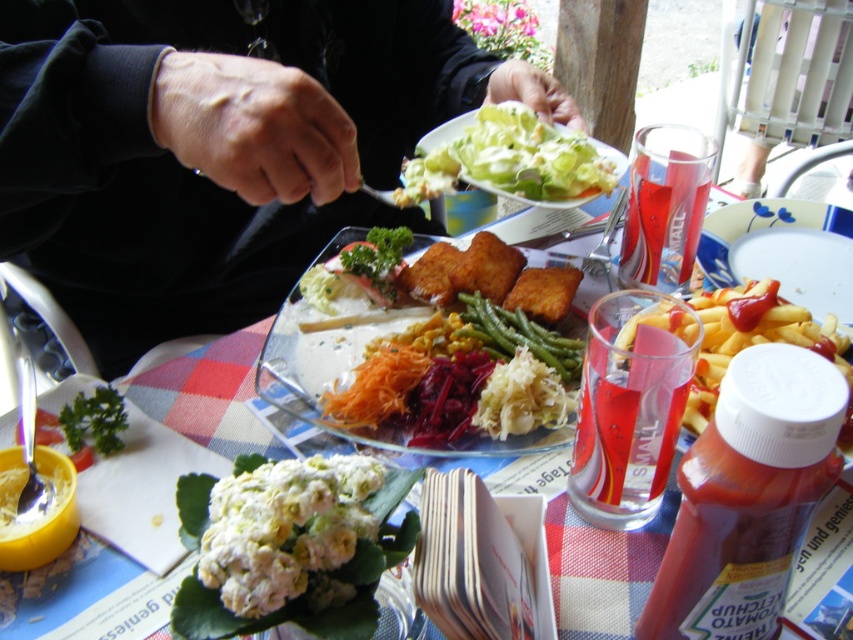
Between white creamy salad at upper center and yellowish matte french fries at right, which one has more height?

With more height is white creamy salad at upper center.

The image size is (853, 640). I want to click on white creamy salad at upper center, so click(521, 156).

Can you confirm if white fluffy salad at center is shorter than green smoothish/texturedish green beans at center?

Incorrect, white fluffy salad at center's height does not fall short of green smoothish/texturedish green beans at center's.

Who is higher up, white fluffy salad at center or green smoothish/texturedish green beans at center?

Positioned higher is green smoothish/texturedish green beans at center.

Between point (347, 604) and point (509, 340), which one is positioned behind?

The point (509, 340) is more distant.

You are a GUI agent. You are given a task and a screenshot of the screen. Output one action in this format:
    pyautogui.click(x=<x>, y=<y>)
    Task: Click on the white fluffy salad at center
    
    Given the screenshot: What is the action you would take?
    pyautogui.click(x=289, y=545)

Who is higher up, yellowish matte french fries at right or green smoothish/texturedish green beans at center?

green smoothish/texturedish green beans at center

Is the position of yellowish matte french fries at right more distant than that of green smoothish/texturedish green beans at center?

No, yellowish matte french fries at right is in front of green smoothish/texturedish green beans at center.

Between point (662, 316) and point (491, 321), which one is positioned in front?

Positioned in front is point (662, 316).

This screenshot has width=853, height=640. I want to click on yellowish matte french fries at right, so click(755, 340).